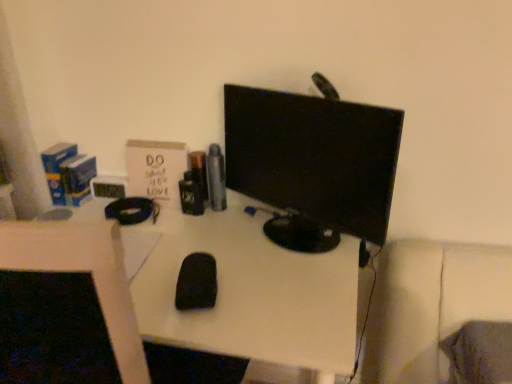
Identify the location of free spot in front of black matte mouse at center. This screenshot has height=384, width=512. pyautogui.click(x=209, y=330).